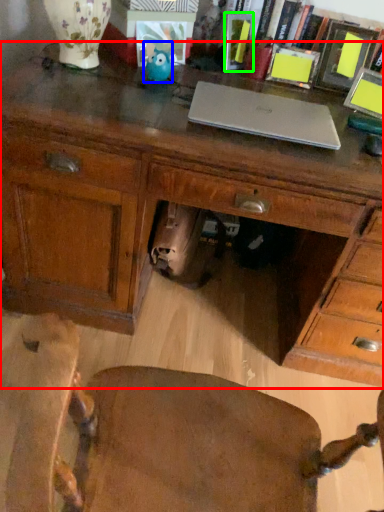
Question: Based on their relative distances, which object is farther from desk (highlighted by a red box)? Choose from toy (highlighted by a blue box) and book (highlighted by a green box).

Choices:
 (A) toy
 (B) book

Answer: (B)